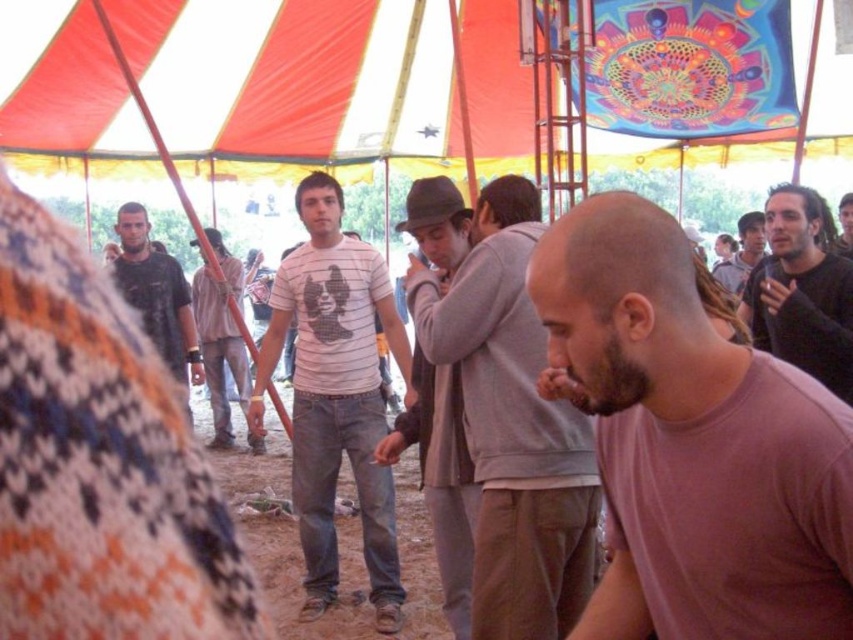
Question: Is black matte shirt at right thinner than dark gray shirt at left?

Choices:
 (A) no
 (B) yes

Answer: (B)

Question: Which point is farther to the camera?

Choices:
 (A) black matte shirt at right
 (B) gray woolen sweater at center
 (C) pink matte shirt at center

Answer: (B)

Question: From the image, what is the correct spatial relationship of black matte shirt at right in relation to dark gray sweater at center?

Choices:
 (A) right
 (B) left

Answer: (B)

Question: Is gray woolen sweater at center thinner than dark brown hair at center?

Choices:
 (A) no
 (B) yes

Answer: (B)

Question: Which of these objects is positioned closest to the black matte shirt at right?

Choices:
 (A) dark gray sweater at center
 (B) gray sweater at center
 (C) dark brown hair at center

Answer: (C)

Question: Based on their relative distances, which object is farther from the gray woolen sweater at center?

Choices:
 (A) white striped shirt at center
 (B) striped cotton shirt at center
 (C) gray sweater at center
 (D) pink matte shirt at center

Answer: (B)